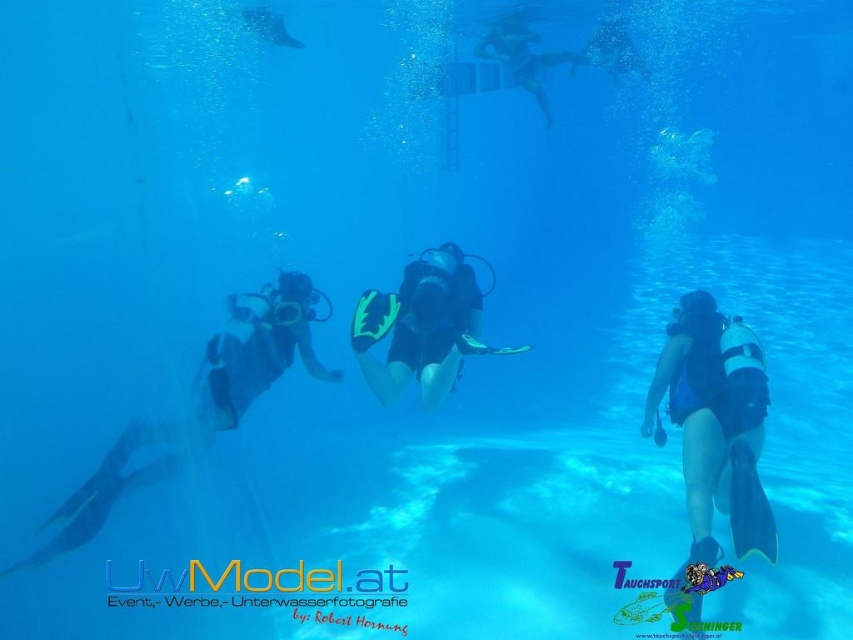
Looking at this image, you are a scuba instructor observing the underwater scene. You notice the blue matte wetsuit at lower right and the black matte scuba gear at center. Which of these two objects appears taller in the image?

The blue matte wetsuit at lower right is much taller than the black matte scuba gear at center according to the description.

You are a scuba diver in the underwater scene. You want to take a photo of the point at coordinates [660,369]. Your camera has a maximum range of 3 meters. Can you capture the point with your current camera?

The point at coordinates [660,369] is 3.58 meters away from the camera, which exceeds the camera maximum range of 3 meters. Therefore, you cannot capture the point with your current camera.

You are a scuba instructor observing the underwater scene. You need to guide the divers to surface safely. Which diver should ascend first, the blue matte wetsuit at lower right or the black matte scuba diver at center?

The blue matte wetsuit at lower right is in front of the black matte scuba diver at center, so the blue matte wetsuit at lower right should ascend first to ensure they clear the path for the others.